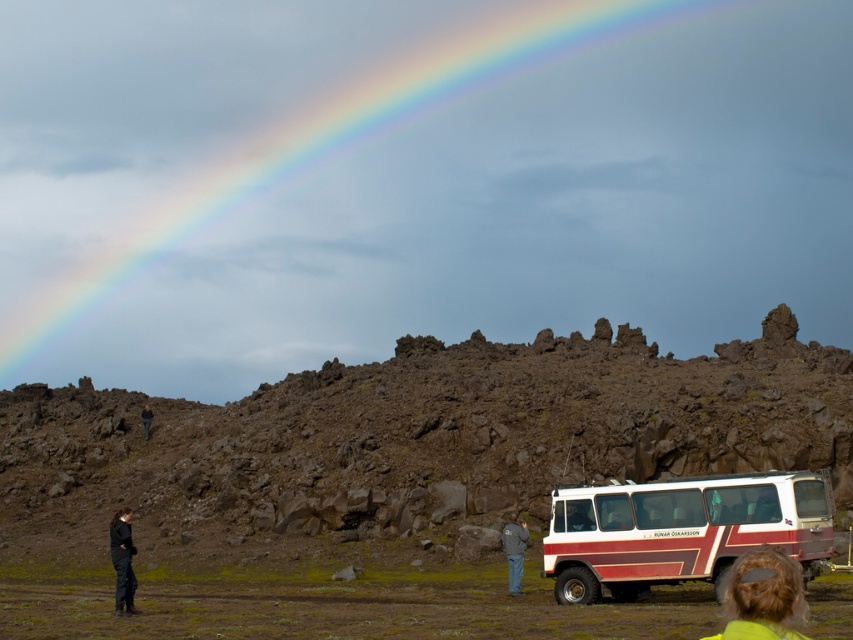
Question: Which of the following is the closest to the observer?

Choices:
 (A) denim jacket at lower center
 (B) light brown hair at lower right
 (C) rainbow at upper center

Answer: (B)

Question: Does rainbow at upper center appear under dark gray pants at left?

Choices:
 (A) yes
 (B) no

Answer: (B)

Question: Does matte red bus at center appear under black fabric jacket at lower left?

Choices:
 (A) yes
 (B) no

Answer: (B)

Question: Is light brown hair at lower right wider than dark gray pants at left?

Choices:
 (A) no
 (B) yes

Answer: (B)

Question: Which point is farther to the camera?

Choices:
 (A) (131, 540)
 (B) (503, 547)
 (C) (807, 92)

Answer: (C)

Question: Which point is closer to the camera?

Choices:
 (A) black fabric jacket at lower left
 (B) light brown hair at lower right
 (C) rainbow at upper center

Answer: (B)